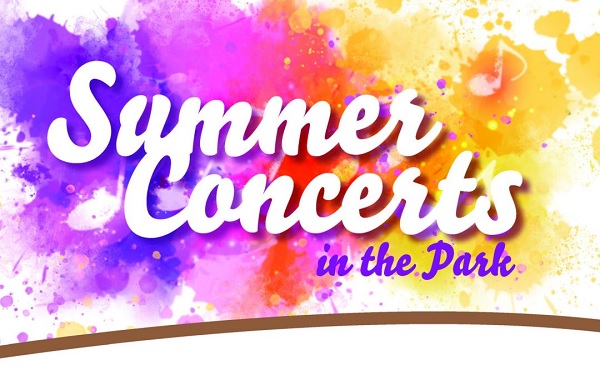
Find the location of a particular element. painted areas of pink is located at coordinates (225, 29), (195, 316), (503, 119).